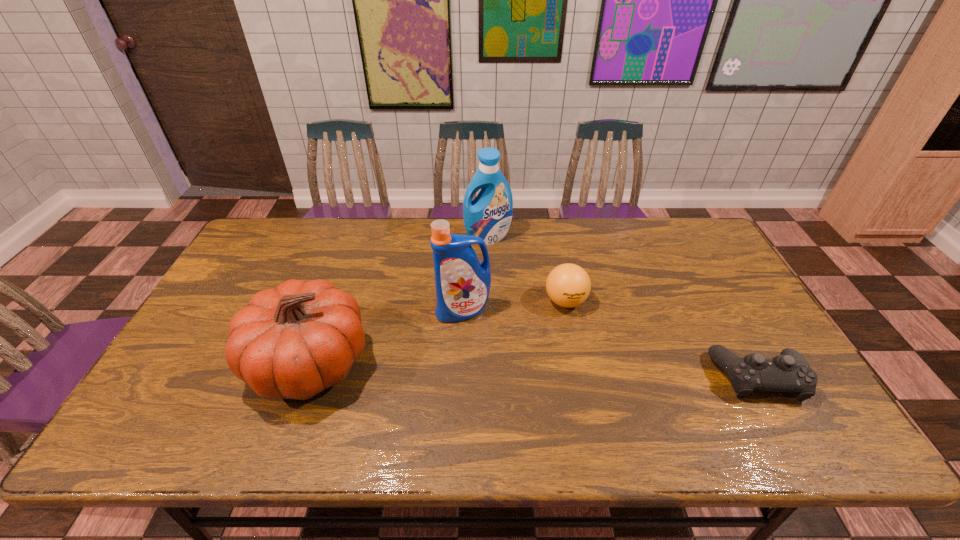
This screenshot has height=540, width=960. Identify the location of free point between the farthest object and the fourth tallest object. (527, 269).

Identify which object is the fourth nearest to the nearer detergent. Please provide its 2D coordinates. Your answer should be formatted as a tuple, i.e. [(x, y)], where the tuple contains the x and y coordinates of a point satisfying the conditions above.

[(789, 372)]

Point out which object is positioned as the third nearest to the farther detergent. Please provide its 2D coordinates. Your answer should be formatted as a tuple, i.e. [(x, y)], where the tuple contains the x and y coordinates of a point satisfying the conditions above.

[(293, 341)]

At what (x,y) coordinates should I click in order to perform the action: click on vacant space that satisfies the following two spatial constraints: 1. on the back side of the nearer detergent; 2. on the left side of the farthest object. Please return your answer as a coordinate pair (x, y). The image size is (960, 540). Looking at the image, I should click on (467, 237).